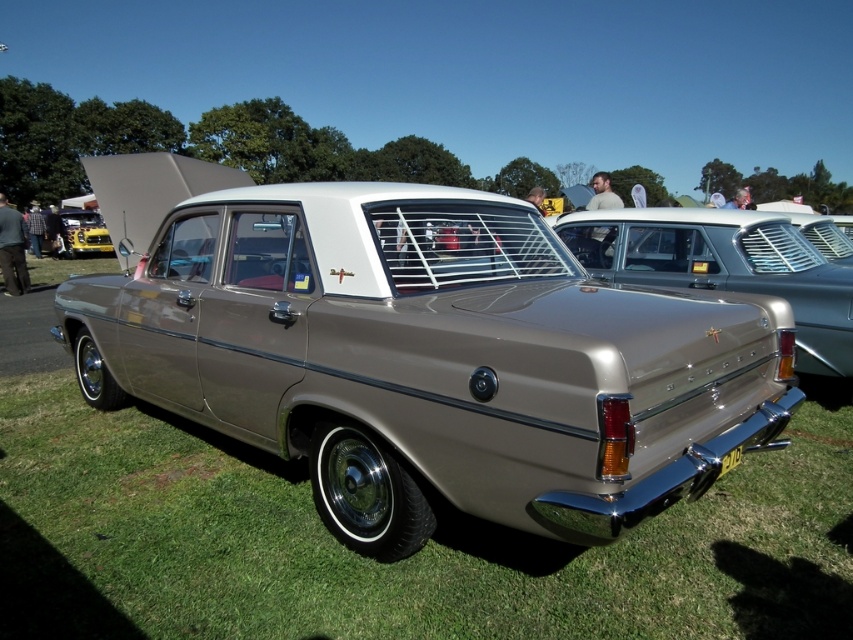
Does metallic gold car at center have a greater height compared to yellow metallic car at left?

Yes.

Does metallic gold car at center have a larger size compared to yellow metallic car at left?

Correct, metallic gold car at center is larger in size than yellow metallic car at left.

Identify the location of metallic gold car at center. (421, 352).